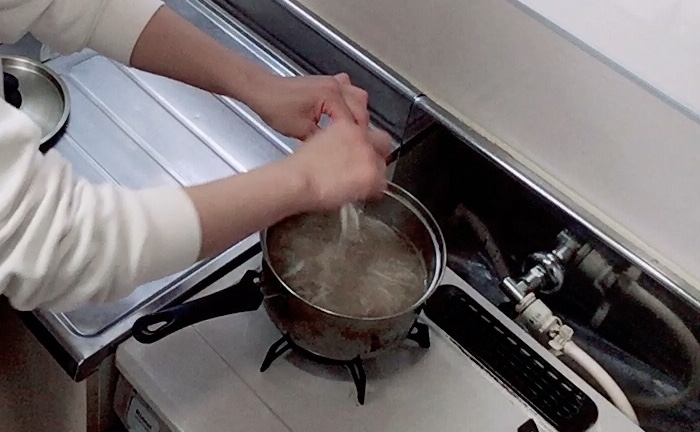
Find the location of a particular element. The height and width of the screenshot is (432, 700). gas stove burner is located at coordinates point(362,371).